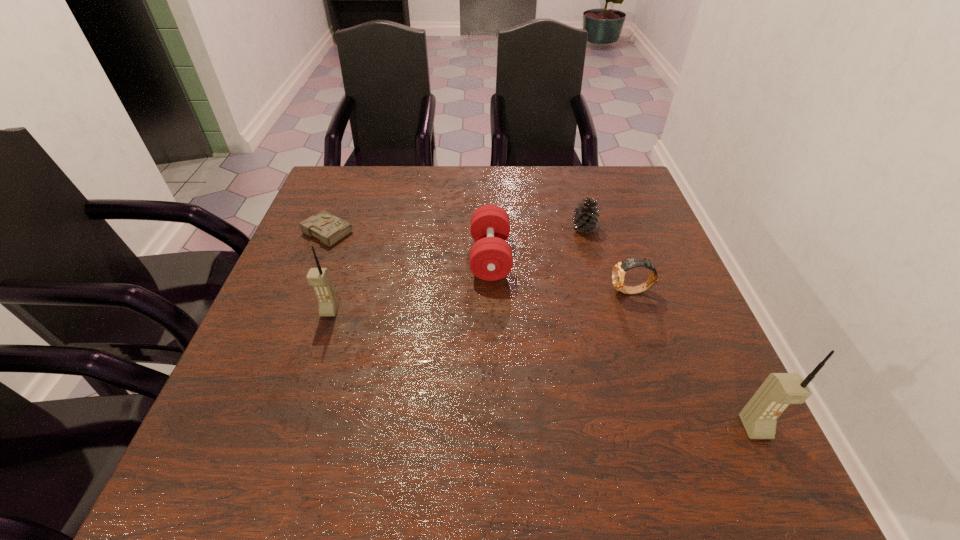
If equal spacing is the goal by inserting an additional cellular_telephone among them, please point out a vacant space for this new cellular_telephone. Please provide its 2D coordinates. Your answer should be formatted as a tuple, i.e. [(x, y)], where the tuple contains the x and y coordinates of a point satisfying the conditions above.

[(518, 362)]